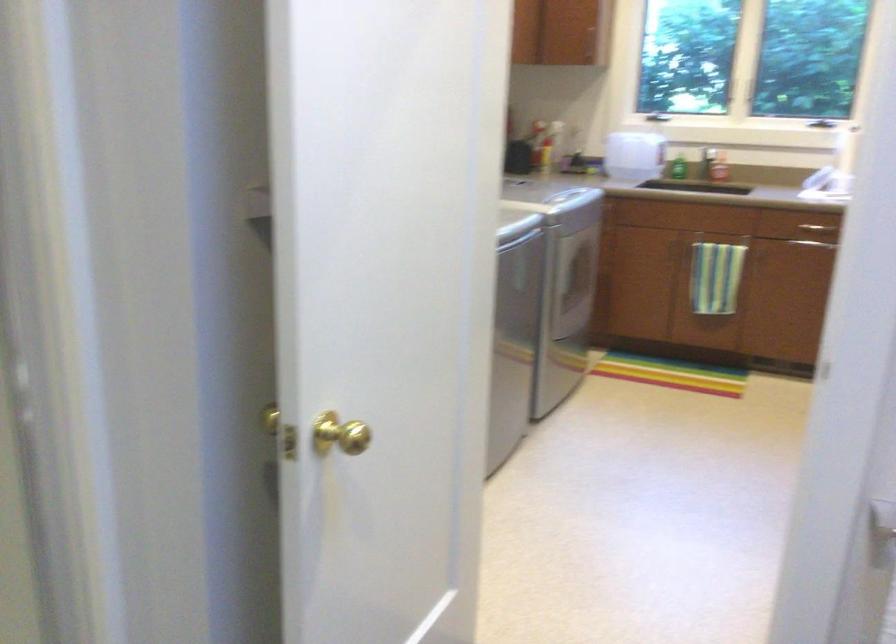
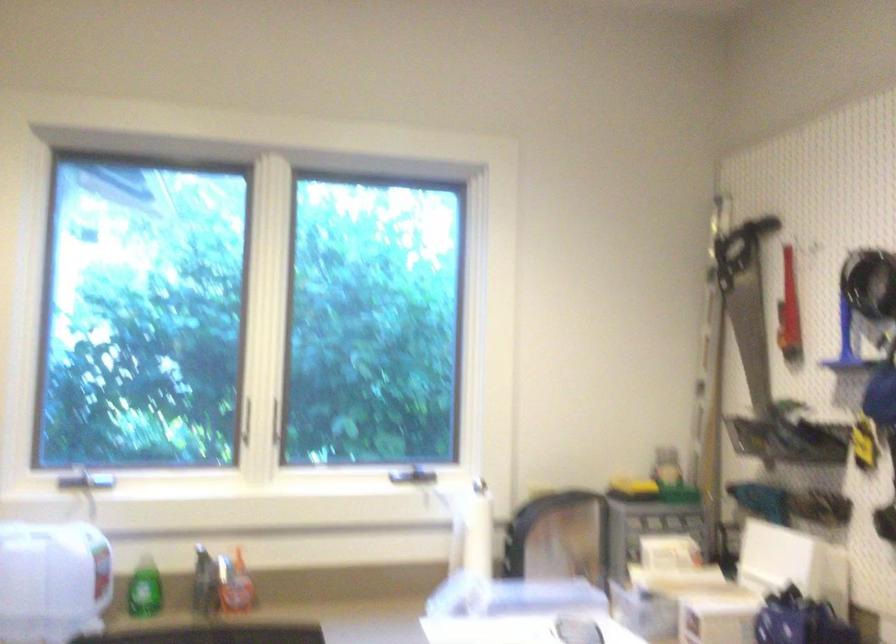
Locate, in the second image, the point that corresponds to [676,162] in the first image.

(143, 589)